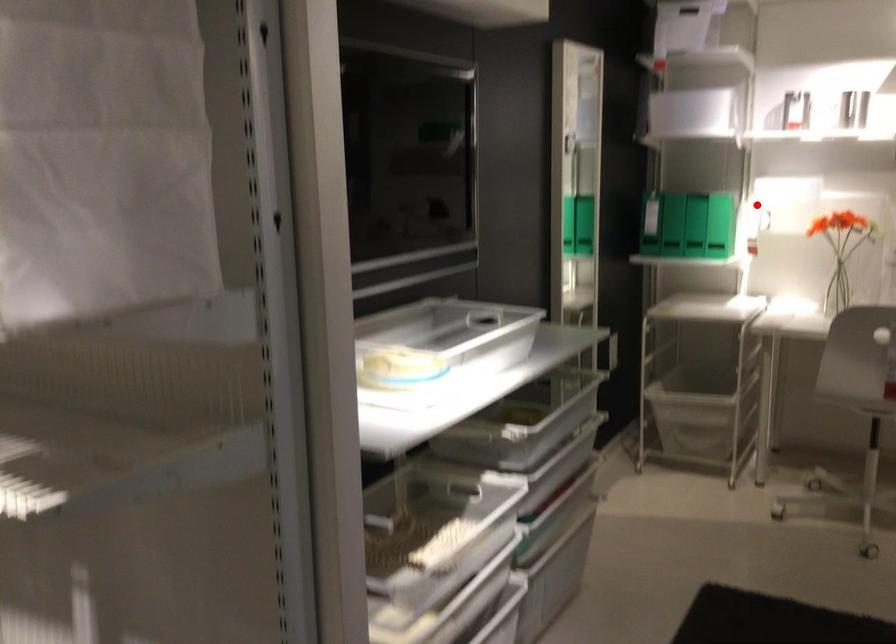
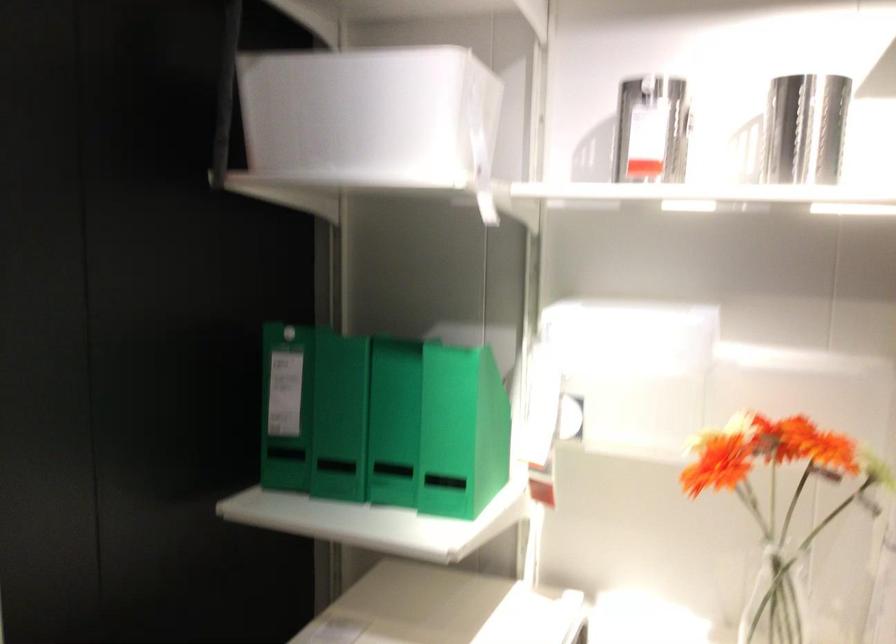
In the second image, find the point that corresponds to the highlighted location in the first image.

(461, 431)